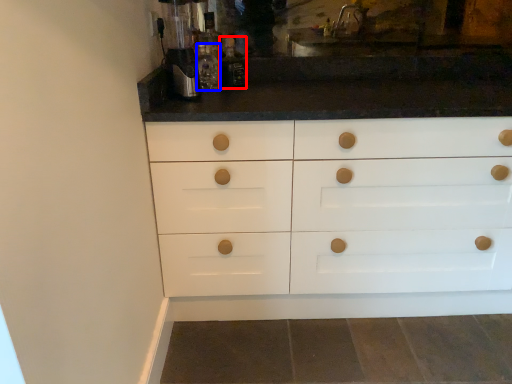
Question: Which object is closer to the camera taking this photo, bottle (highlighted by a red box) or bottle (highlighted by a blue box)?

Choices:
 (A) bottle
 (B) bottle

Answer: (B)